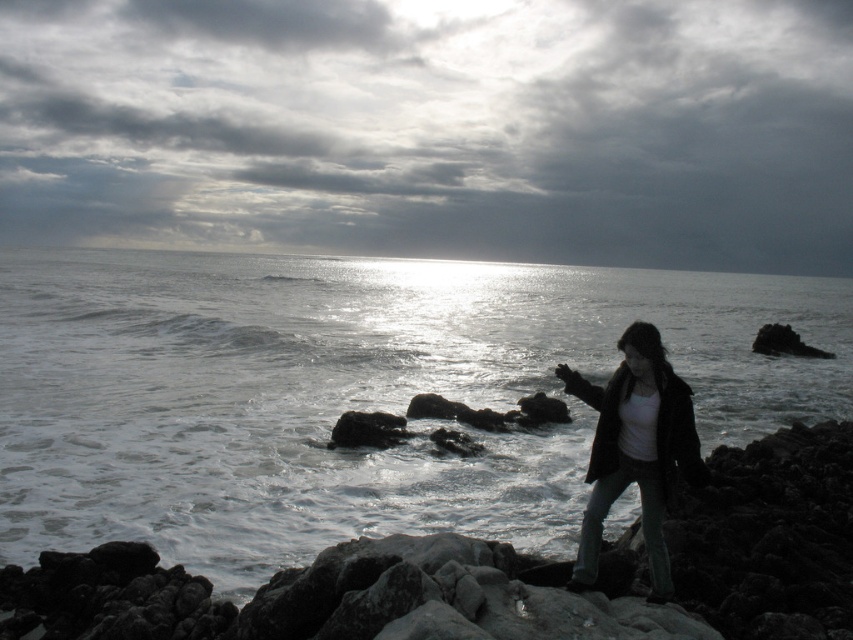
You are a photographer planning to take a picture of the cloudy sky at upper center and the rough textured rocks at lower right. Based on their positions, which object should you focus on first to ensure both are in the frame?

You should focus on the cloudy sky at upper center first because it is located above the rough textured rocks at lower right, so adjusting the frame to include the upper object first will naturally include the lower one if positioned correctly.

In the scene shown: You are an artist planning to paint the scene. You need to decide which area to focus on first based on their sizes. Which object should you paint first, the cloudy sky at upper center or the matte black jacket at lower right?

The cloudy sky at upper center should be painted first because its width is larger than the matte black jacket at lower right, making it a more prominent feature in the composition.

You are a photographer planning to take a picture of the cloudy sky at upper center and the matte black jacket at lower right. Which object will occupy more space in your photo?

The cloudy sky at upper center will occupy more space in the photo since it is larger in size than the matte black jacket at lower right.